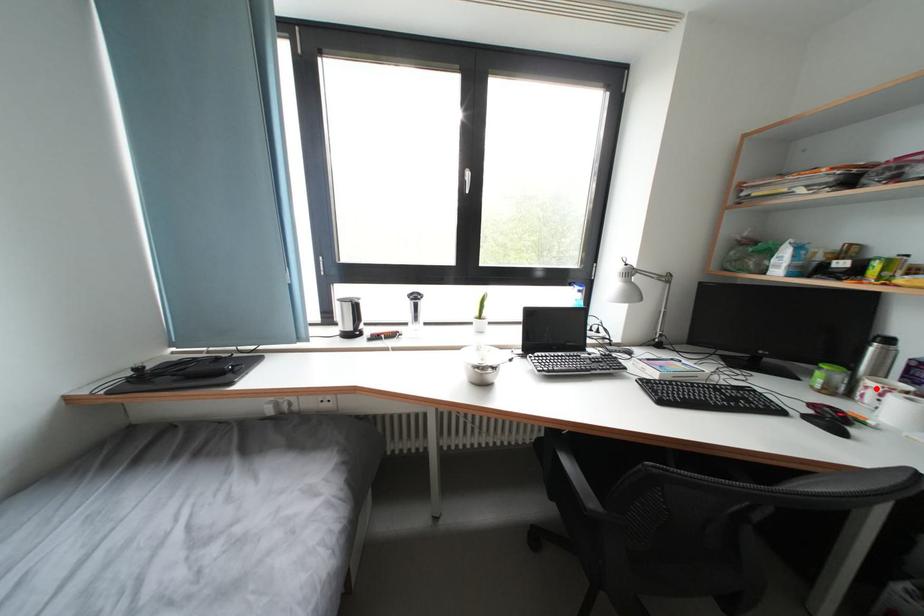
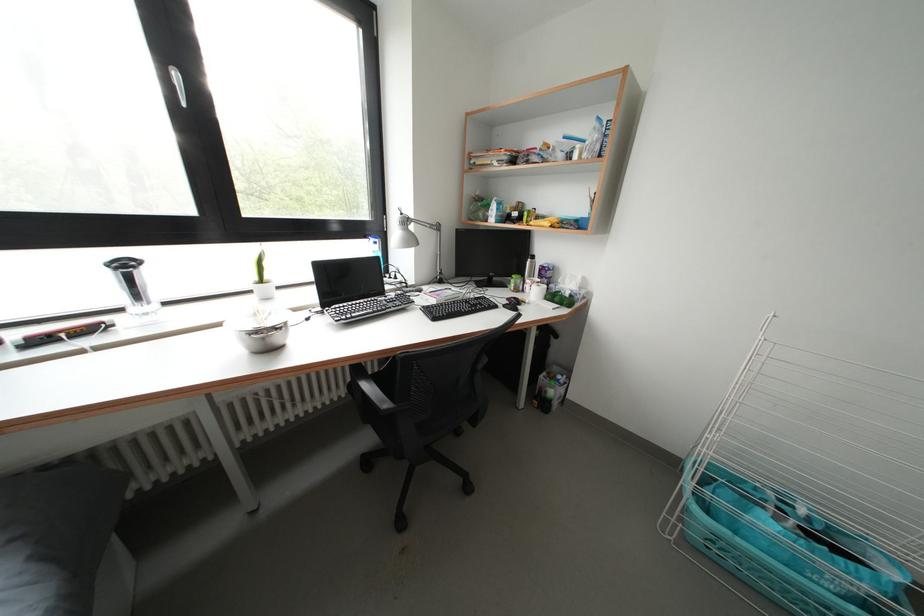
Find the pixel in the second image that matches the highlighted location in the first image.

(535, 286)